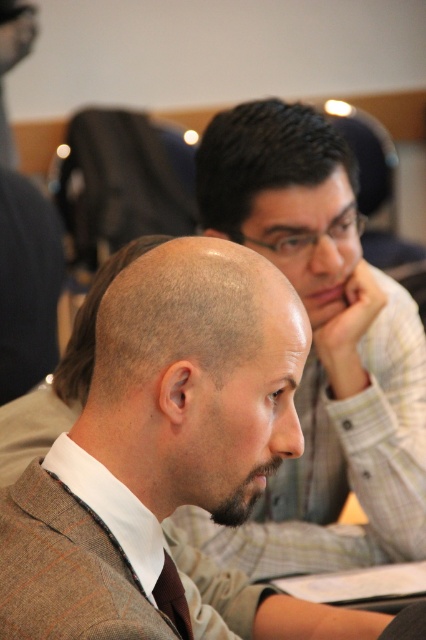
You are a photographer standing in the back of the room. You need to take a photo of both the brown hair at center and the dark brown beard at center. Which one will be more visible in the photo?

The brown hair at center is much taller than the dark brown beard at center, so the brown hair at center will be more visible in the photo.

You are observing two people in the conference room. The man in the light brown suit is sitting at the table. You notice the brown hair at center and the dark brown beard at center. Which of these is positioned to the left?

The brown hair at center is to the left of the dark brown beard at center.

You are standing at the entrance of the conference room. You see two points marked in the scene. The first point is at coordinate point(x=298, y=372) and the second is at point(x=155, y=584). Which point is closer to you?

Point(x=298, y=372) is in front of point(x=155, y=584), so it is closer to you.